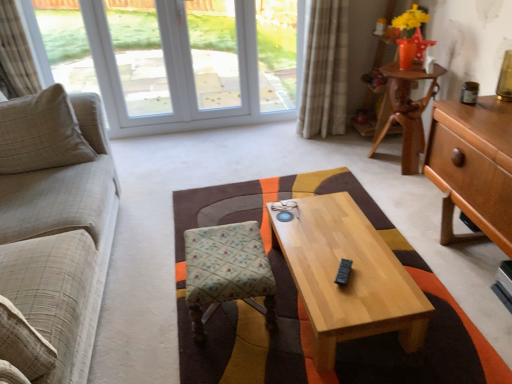
Question: Can you confirm if light wood/texture coffee table at center is smaller than light brown wood desk at right, which appears as the first desk when viewed from the front?

Choices:
 (A) no
 (B) yes

Answer: (B)

Question: Does light wood/texture coffee table at center contain light brown wood desk at right, which is the second desk in back-to-front order?

Choices:
 (A) yes
 (B) no

Answer: (B)

Question: From the image's perspective, is light wood/texture coffee table at center on top of light brown wood desk at right, which appears as the first desk when viewed from the front?

Choices:
 (A) no
 (B) yes

Answer: (A)

Question: Can you confirm if light wood/texture coffee table at center is positioned to the right of light brown wood desk at right, which appears as the first desk when viewed from the front?

Choices:
 (A) no
 (B) yes

Answer: (A)

Question: Can you confirm if light wood/texture coffee table at center is wider than light brown wood desk at right, which appears as the first desk when viewed from the front?

Choices:
 (A) yes
 (B) no

Answer: (A)

Question: Is plaid fabric curtain at upper right, the first curtain viewed from the right, in front of or behind patterned fabric stool at center in the image?

Choices:
 (A) front
 (B) behind

Answer: (B)

Question: Is plaid fabric curtain at upper right, the first curtain viewed from the right, bigger or smaller than patterned fabric stool at center?

Choices:
 (A) big
 (B) small

Answer: (A)

Question: From a real-world perspective, is plaid fabric curtain at upper right, the first curtain viewed from the right, positioned above or below patterned fabric stool at center?

Choices:
 (A) above
 (B) below

Answer: (A)

Question: Would you say plaid fabric curtain at upper right, the 2th curtain in the left-to-right sequence, is to the left or to the right of patterned fabric stool at center in the picture?

Choices:
 (A) left
 (B) right

Answer: (B)

Question: From the image's perspective, is wooden desk at upper right, which is the 1th desk in back-to-front order, located above or below beige plaid fabric couch at left?

Choices:
 (A) above
 (B) below

Answer: (A)

Question: Considering the positions of point (422, 129) and point (2, 115), is point (422, 129) closer or farther from the camera than point (2, 115)?

Choices:
 (A) closer
 (B) farther

Answer: (B)

Question: From a real-world perspective, relative to beige plaid fabric couch at left, is wooden desk at upper right, which ranks as the second desk in front-to-back order, vertically above or below?

Choices:
 (A) above
 (B) below

Answer: (B)

Question: Considering the positions of wooden desk at upper right, which ranks as the second desk in front-to-back order, and beige plaid fabric couch at left in the image, is wooden desk at upper right, which ranks as the second desk in front-to-back order, taller or shorter than beige plaid fabric couch at left?

Choices:
 (A) tall
 (B) short

Answer: (B)

Question: From a real-world perspective, relative to matte brown jar at upper right, is white plastic window at upper left vertically above or below?

Choices:
 (A) below
 (B) above

Answer: (A)

Question: Considering the relative positions of white plastic window at upper left and matte brown jar at upper right in the image provided, is white plastic window at upper left to the left or to the right of matte brown jar at upper right?

Choices:
 (A) left
 (B) right

Answer: (A)